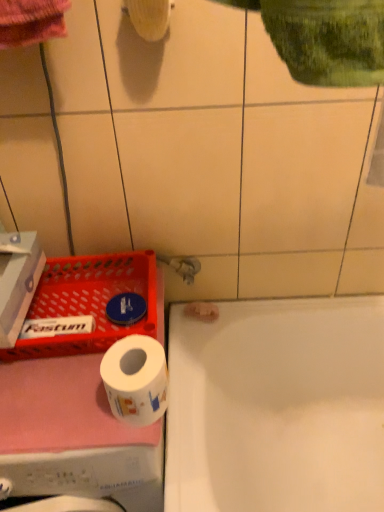
Find the location of a particular element. The height and width of the screenshot is (512, 384). free space to the left of white matte toilet paper at lower left is located at coordinates (57, 402).